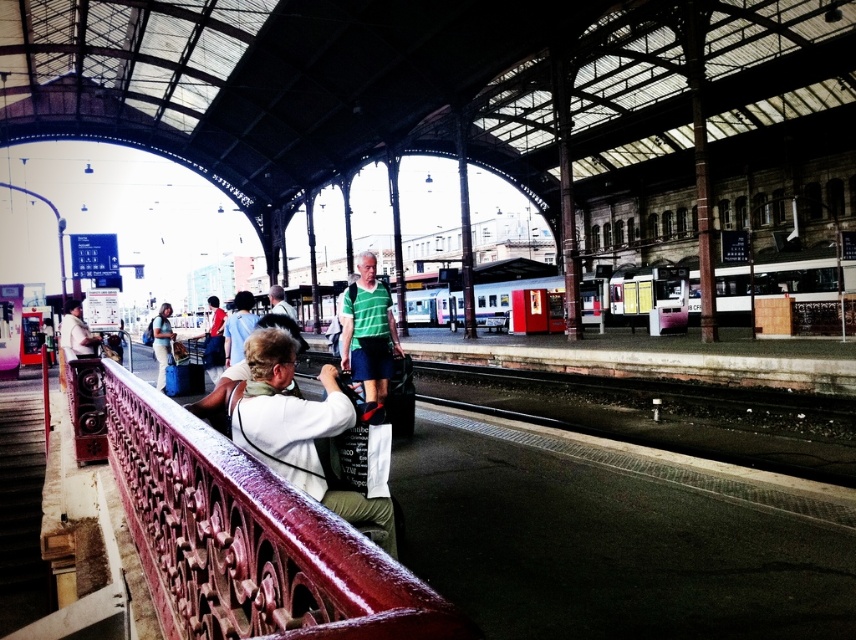
Question: Which point is farther to the camera?

Choices:
 (A) (163, 579)
 (B) (235, 428)

Answer: (A)

Question: Is white fabric camera at center below green fabric shirt at center?

Choices:
 (A) no
 (B) yes

Answer: (B)

Question: Which is farther from the polished metal railing at lower left?

Choices:
 (A) white fabric camera at center
 (B) matte white shirt at left

Answer: (B)

Question: Does polished metal railing at lower left come behind matte white shirt at left?

Choices:
 (A) yes
 (B) no

Answer: (B)

Question: Is polished metal railing at lower left positioned at the back of green fabric shirt at center?

Choices:
 (A) yes
 (B) no

Answer: (B)

Question: Among these points, which one is farthest from the camera?

Choices:
 (A) pyautogui.click(x=76, y=342)
 (B) pyautogui.click(x=343, y=310)
 (C) pyautogui.click(x=307, y=448)
 (D) pyautogui.click(x=280, y=612)

Answer: (A)